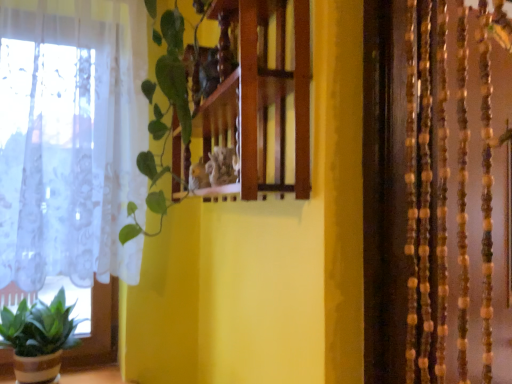
Question: Is green leafy plant at center turned away from wooden shelf at center?

Choices:
 (A) yes
 (B) no

Answer: (A)

Question: From the image's perspective, does green leafy plant at center appear higher than wooden shelf at center?

Choices:
 (A) yes
 (B) no

Answer: (B)

Question: Would you say green leafy plant at center is a long distance from wooden shelf at center?

Choices:
 (A) yes
 (B) no

Answer: (B)

Question: Is green leafy plant at center positioned behind wooden shelf at center?

Choices:
 (A) no
 (B) yes

Answer: (B)

Question: Considering the relative sizes of green leafy plant at center and wooden shelf at center in the image provided, is green leafy plant at center wider than wooden shelf at center?

Choices:
 (A) no
 (B) yes

Answer: (B)

Question: Considering the positions of green matte plant at lower left and green leafy plant at center in the image, is green matte plant at lower left bigger or smaller than green leafy plant at center?

Choices:
 (A) small
 (B) big

Answer: (A)

Question: Considering the relative positions of green matte plant at lower left and green leafy plant at center in the image provided, is green matte plant at lower left to the left or to the right of green leafy plant at center?

Choices:
 (A) right
 (B) left

Answer: (B)

Question: Is point pos(10,334) closer or farther from the camera than point pos(159,163)?

Choices:
 (A) closer
 (B) farther

Answer: (B)

Question: Relative to green leafy plant at center, is green matte plant at lower left in front or behind?

Choices:
 (A) front
 (B) behind

Answer: (B)

Question: From a real-world perspective, is wooden shelf at center physically located above or below green leafy plant at center?

Choices:
 (A) below
 (B) above

Answer: (B)

Question: From the image's perspective, relative to green leafy plant at center, is wooden shelf at center above or below?

Choices:
 (A) above
 (B) below

Answer: (A)

Question: Would you say wooden shelf at center is to the left or to the right of green leafy plant at center in the picture?

Choices:
 (A) left
 (B) right

Answer: (B)

Question: Based on their sizes in the image, would you say wooden shelf at center is bigger or smaller than green leafy plant at center?

Choices:
 (A) small
 (B) big

Answer: (B)

Question: From the image's perspective, relative to wooden shelf at center, is green matte plant at lower left above or below?

Choices:
 (A) below
 (B) above

Answer: (A)

Question: In terms of size, does green matte plant at lower left appear bigger or smaller than wooden shelf at center?

Choices:
 (A) small
 (B) big

Answer: (A)